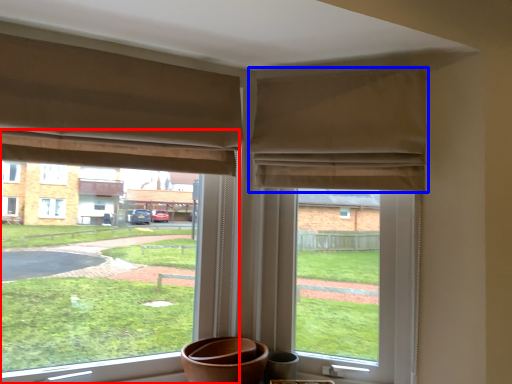
Question: Among these objects, which one is nearest to the camera, window (highlighted by a red box) or curtain (highlighted by a blue box)?

Choices:
 (A) window
 (B) curtain

Answer: (A)